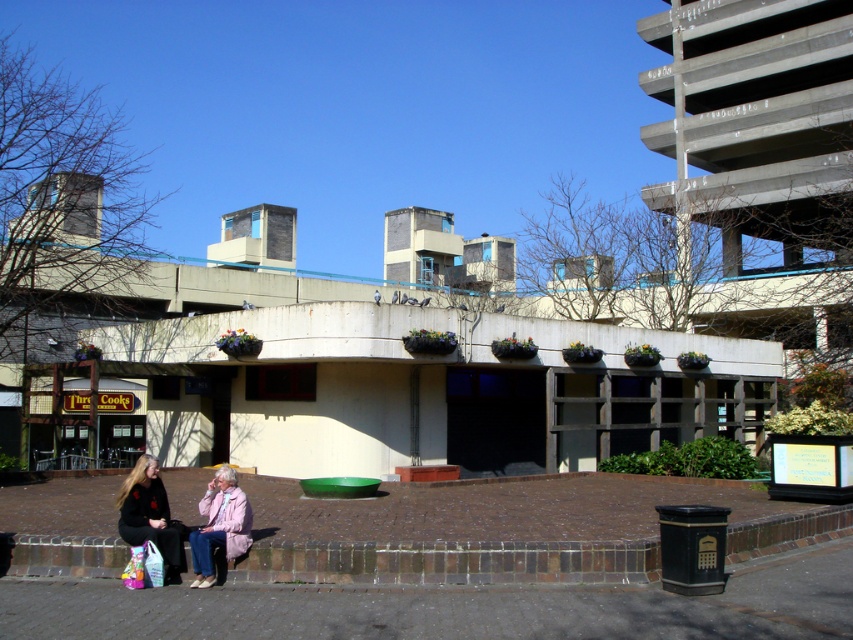
Question: Which of the following is the farthest from the observer?

Choices:
 (A) (4, 579)
 (B) (160, 493)

Answer: (B)

Question: Which object appears closest to the camera in this image?

Choices:
 (A) light pink fabric coat at lower left
 (B) brown brick pavement at lower center

Answer: (B)

Question: Estimate the real-world distances between objects in this image. Which object is farther from the brown brick pavement at lower center?

Choices:
 (A) light pink fabric coat at lower left
 (B) black fabric jacket at lower left

Answer: (B)

Question: Is black fabric jacket at lower left bigger than light pink fabric coat at lower left?

Choices:
 (A) yes
 (B) no

Answer: (A)

Question: Is black fabric jacket at lower left to the left of light pink fabric coat at lower left from the viewer's perspective?

Choices:
 (A) yes
 (B) no

Answer: (A)

Question: Is brown brick pavement at lower center positioned at the back of black fabric jacket at lower left?

Choices:
 (A) no
 (B) yes

Answer: (A)